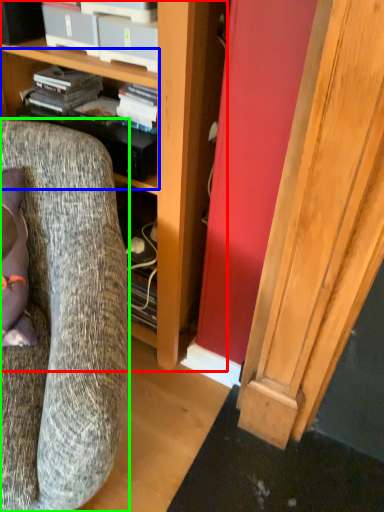
Question: Which object is the farthest from cabinetry (highlighted by a red box)? Choose among these: shelf (highlighted by a blue box) or chair (highlighted by a green box).

Choices:
 (A) shelf
 (B) chair

Answer: (B)